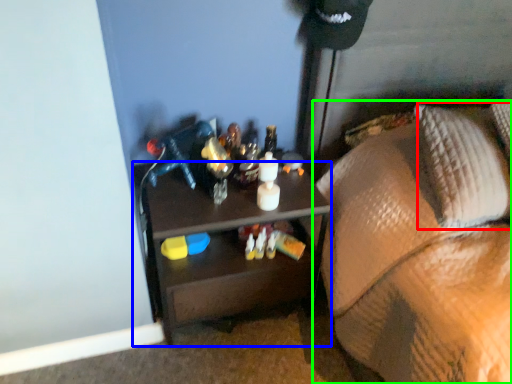
Question: Estimate the real-world distances between objects in this image. Which object is closer to pillow (highlighted by a red box), desk (highlighted by a blue box) or furniture (highlighted by a green box)?

Choices:
 (A) desk
 (B) furniture

Answer: (B)